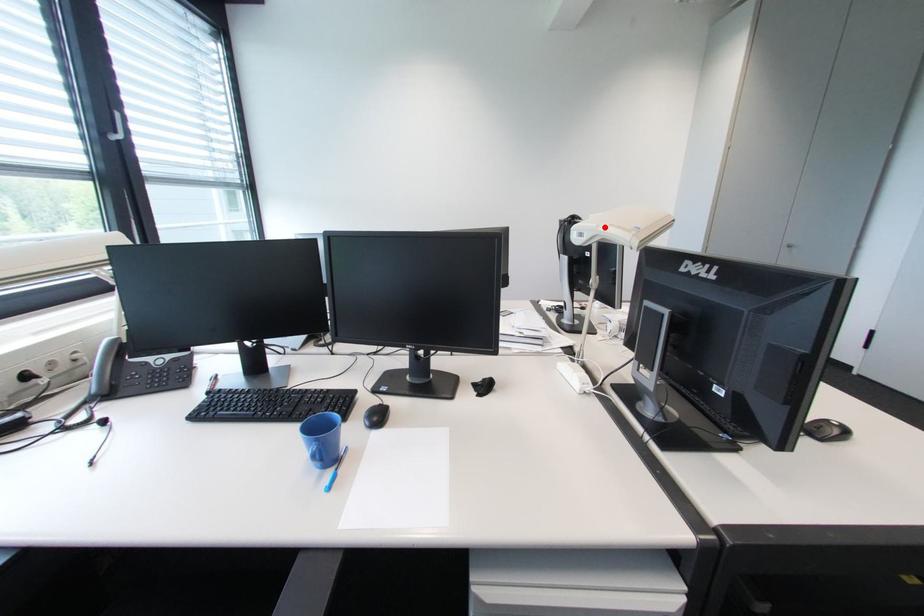
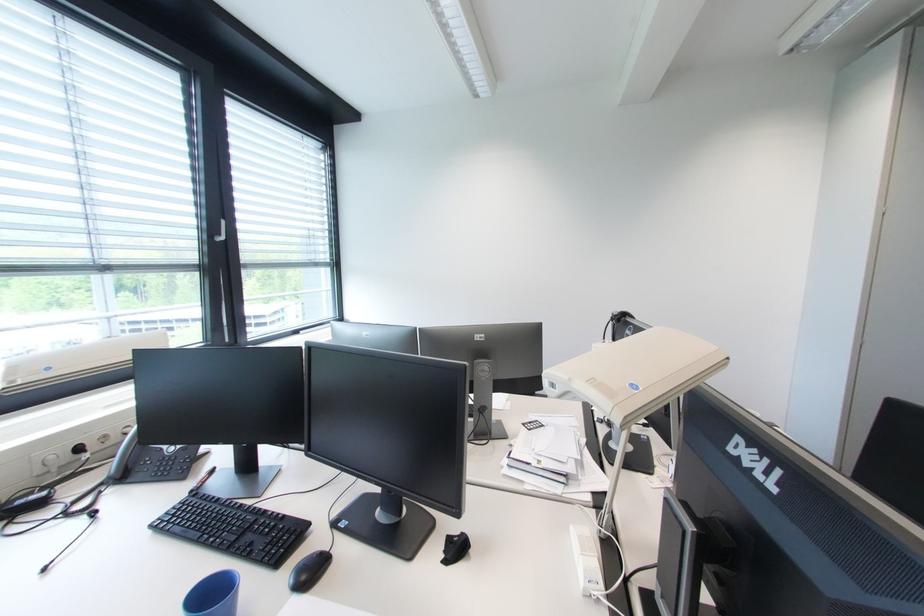
In the second image, find the point that corresponds to the highlighted location in the first image.

(577, 381)